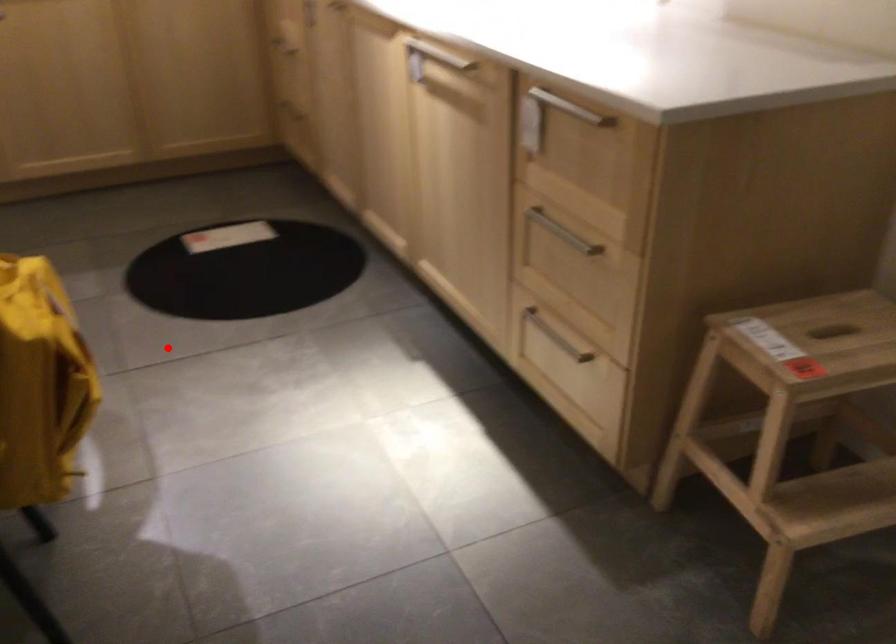
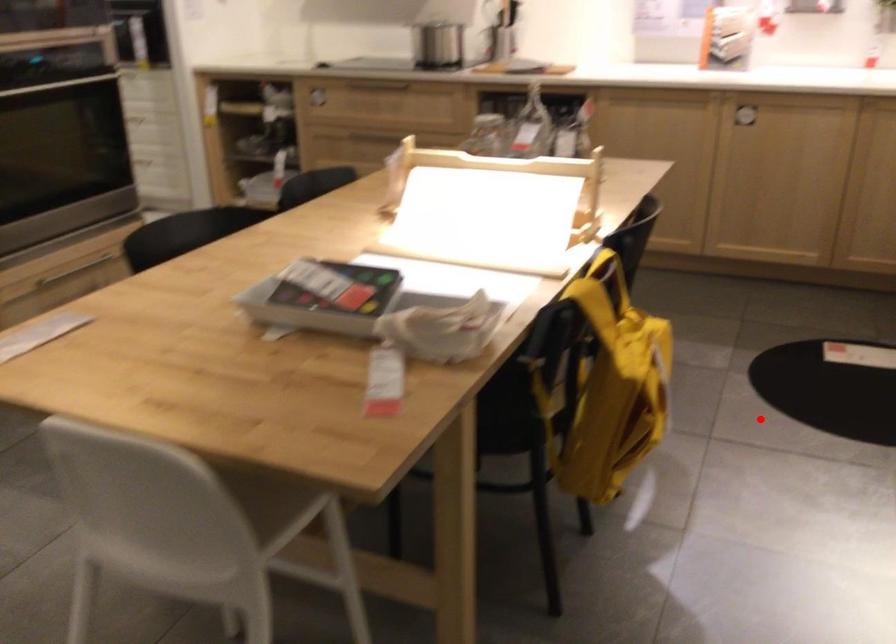
I am providing you with two images of the same scene from different viewpoints. A red point is marked on the first image and another point is marked on the second image. Are the points marked in image1 and image2 representing the same 3D position?

Yes